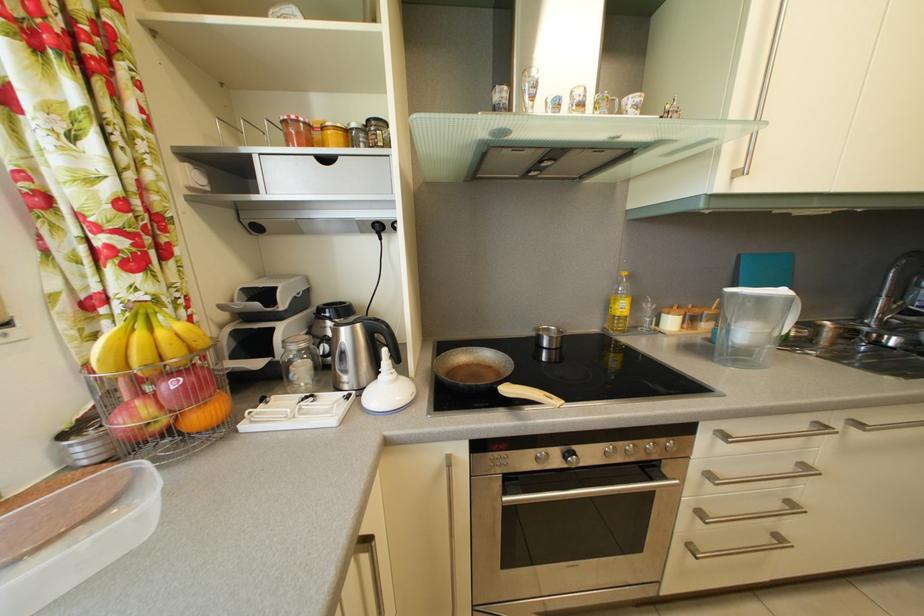
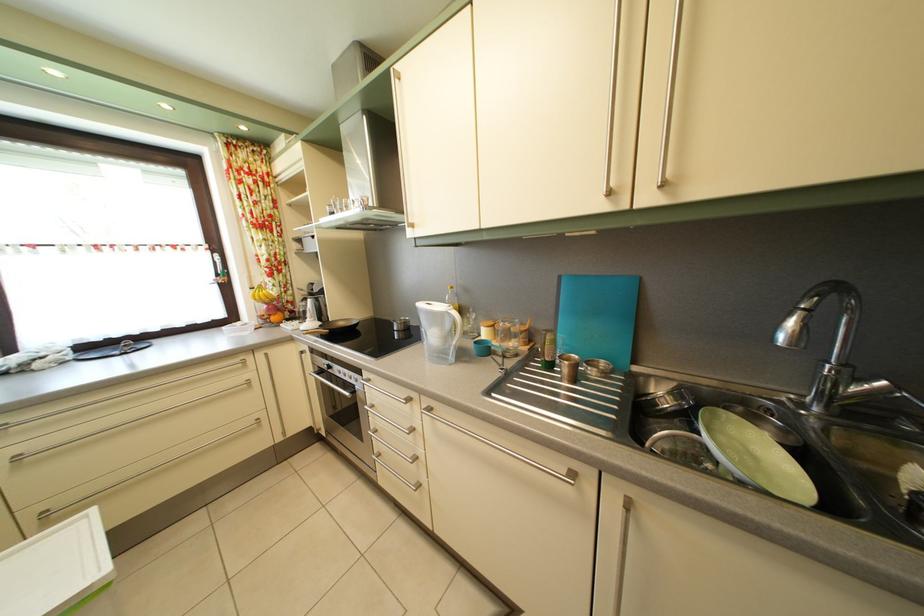
Find the pixel in the second image that matches [835,342] in the first image.

(574, 378)